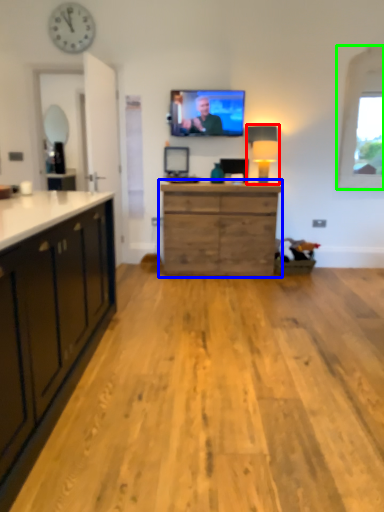
Question: Which is farther away from lamp (highlighted by a red box)? chest of drawers (highlighted by a blue box) or window (highlighted by a green box)?

Choices:
 (A) chest of drawers
 (B) window

Answer: (B)